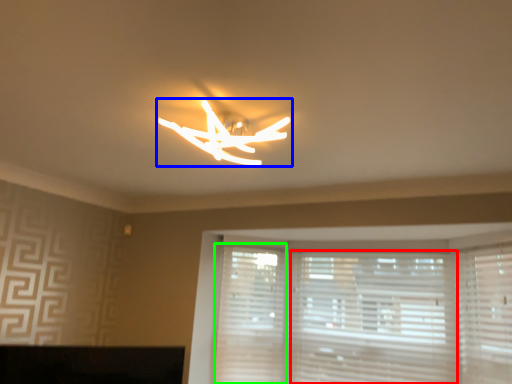
Question: Which object is the farthest from blind (highlighted by a red box)? Choose among these: lamp (highlighted by a blue box) or shutter (highlighted by a green box).

Choices:
 (A) lamp
 (B) shutter

Answer: (A)